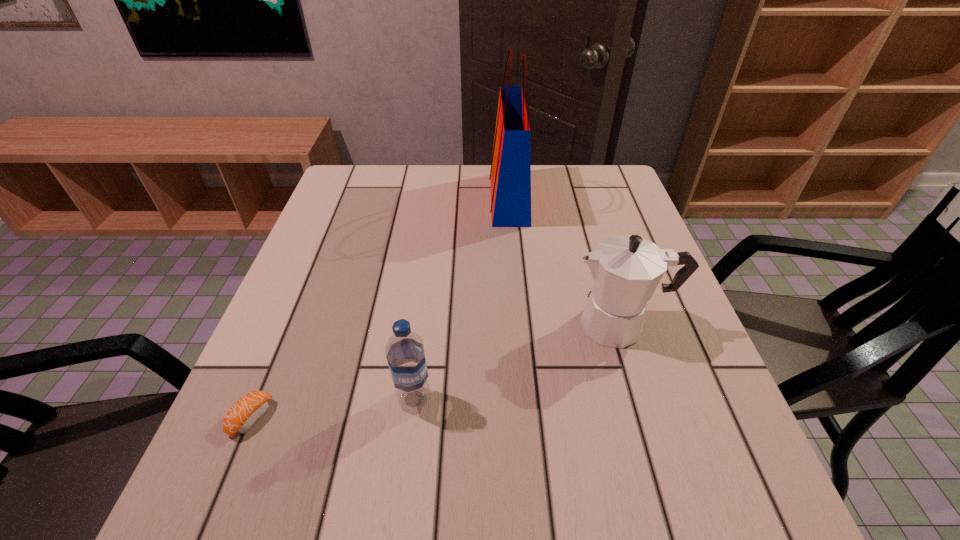
Image resolution: width=960 pixels, height=540 pixels. In order to click on the third object from left to right in this screenshot , I will do `click(510, 176)`.

At what (x,y) coordinates should I click in order to perform the action: click on the tallest object. Please return your answer as a coordinate pair (x, y). Looking at the image, I should click on (510, 176).

The height and width of the screenshot is (540, 960). Identify the location of the third nearest object. (x=626, y=269).

Image resolution: width=960 pixels, height=540 pixels. I want to click on coffeepot, so pyautogui.click(x=626, y=269).

Locate an element on the screen. The image size is (960, 540). the third tallest object is located at coordinates (405, 355).

Where is `the second object from left to right`? The width and height of the screenshot is (960, 540). the second object from left to right is located at coordinates (405, 355).

Locate an element on the screen. This screenshot has height=540, width=960. the shortest object is located at coordinates (246, 411).

Find the location of a particular element. The width and height of the screenshot is (960, 540). sushi is located at coordinates (246, 411).

This screenshot has width=960, height=540. Find the location of `free region located on the handle side of the farthest object`. free region located on the handle side of the farthest object is located at coordinates (420, 199).

Locate an element on the screen. The height and width of the screenshot is (540, 960). free spot located 0.060m on the handle side of the farthest object is located at coordinates (468, 199).